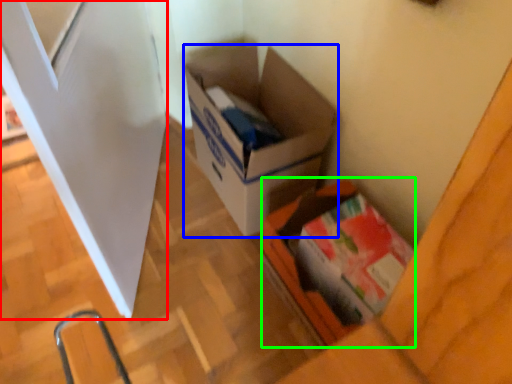
Question: Estimate the real-world distances between objects in this image. Which object is closer to screen door (highlighted by a red box), box (highlighted by a blue box) or box (highlighted by a green box)?

Choices:
 (A) box
 (B) box

Answer: (A)